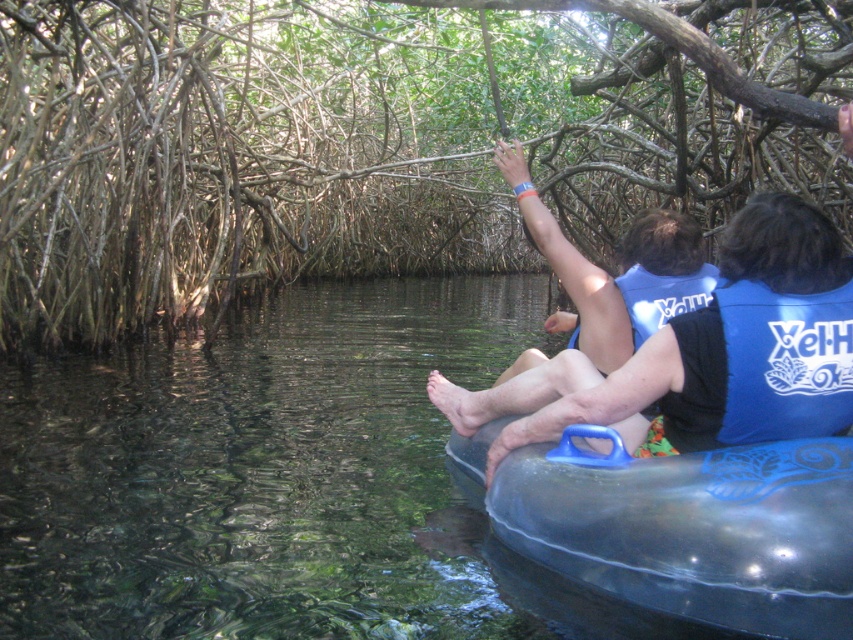
Question: Does brown textured tree roots at center come in front of clear water at center?

Choices:
 (A) no
 (B) yes

Answer: (A)

Question: Estimate the real-world distances between objects in this image. Which object is closer to the brown textured tree roots at center?

Choices:
 (A) blue life vest at center
 (B) blue fabric life jacket at center

Answer: (A)

Question: Which point is farther to the camera?

Choices:
 (A) blue life vest at center
 (B) clear water at center
 (C) blue fabric life jacket at center
 (D) brown textured tree roots at center

Answer: (D)

Question: Observing the image, what is the correct spatial positioning of blue life vest at center in reference to blue fabric life jacket at center?

Choices:
 (A) left
 (B) right

Answer: (A)

Question: Is blue life vest at center bigger than blue fabric life jacket at center?

Choices:
 (A) no
 (B) yes

Answer: (B)

Question: Considering the real-world distances, which object is closest to the blue life vest at center?

Choices:
 (A) blue fabric life jacket at center
 (B) clear water at center

Answer: (A)